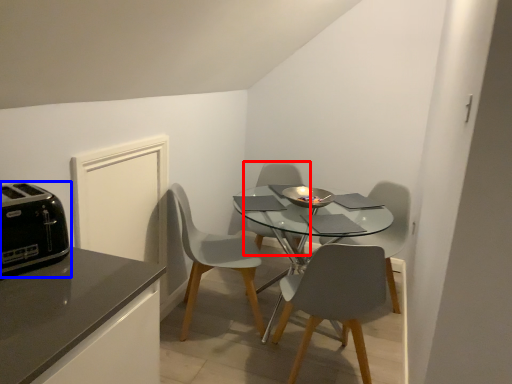
Question: Among these objects, which one is farthest to the camera, chair (highlighted by a red box) or toaster (highlighted by a blue box)?

Choices:
 (A) chair
 (B) toaster

Answer: (A)